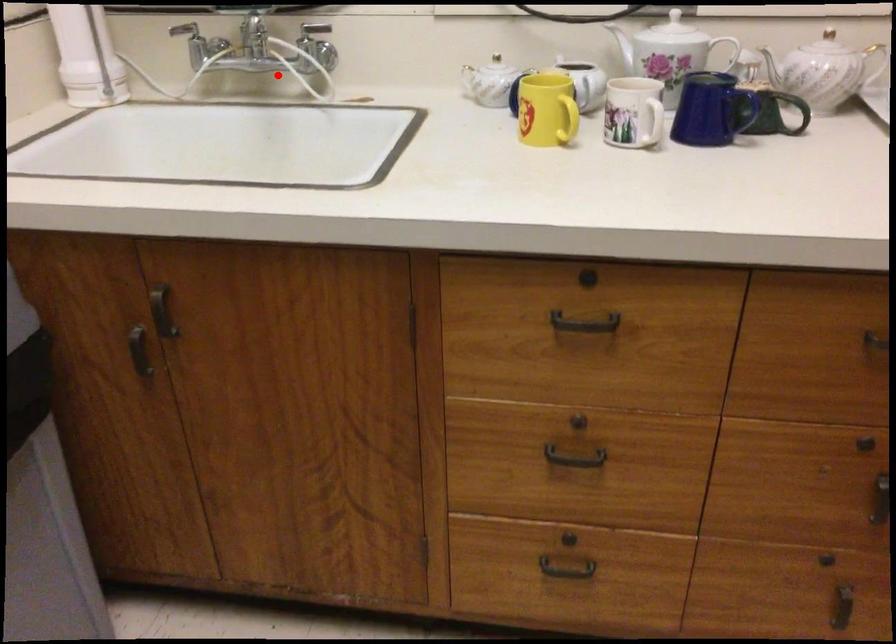
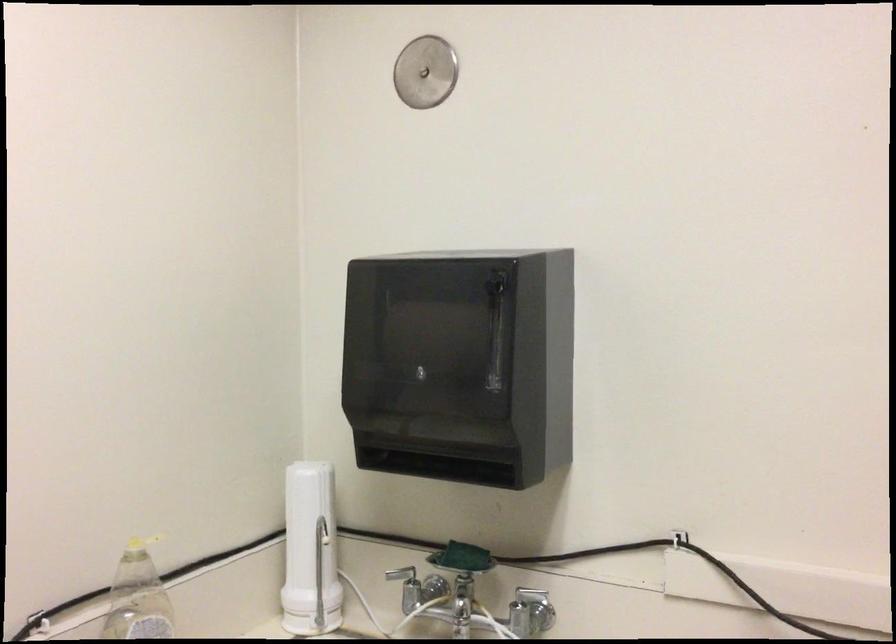
Where in the second image is the point corresponding to the highlighted location from the first image?

(490, 621)